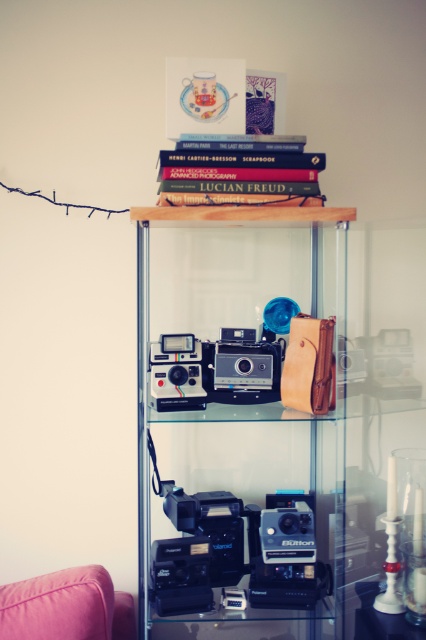
Does hardcover book at upper center appear over pink fabric couch at lower left?

Yes, hardcover book at upper center is above pink fabric couch at lower left.

Is hardcover book at upper center to the right of pink fabric couch at lower left from the viewer's perspective?

Yes, hardcover book at upper center is to the right of pink fabric couch at lower left.

Locate an element on the screen. hardcover book at upper center is located at coordinates (238, 170).

Identify the location of hardcover book at upper center. Image resolution: width=426 pixels, height=640 pixels. (238, 170).

Between pink fabric couch at lower left and matte black camera at center, which one has less height?

With less height is matte black camera at center.

How distant is pink fabric couch at lower left from matte black camera at center?

pink fabric couch at lower left and matte black camera at center are 50.28 centimeters apart.

Locate an element on the screen. This screenshot has width=426, height=640. pink fabric couch at lower left is located at coordinates (x=66, y=605).

Is pink fabric couch at lower left positioned behind satin silver camera at center?

No, pink fabric couch at lower left is in front of satin silver camera at center.

This screenshot has width=426, height=640. What are the coordinates of `pink fabric couch at lower left` in the screenshot? It's located at (66, 605).

Does point (63, 586) come behind point (273, 387)?

No, (63, 586) is closer to viewer.

This screenshot has height=640, width=426. What are the coordinates of `pink fabric couch at lower left` in the screenshot? It's located at (66, 605).